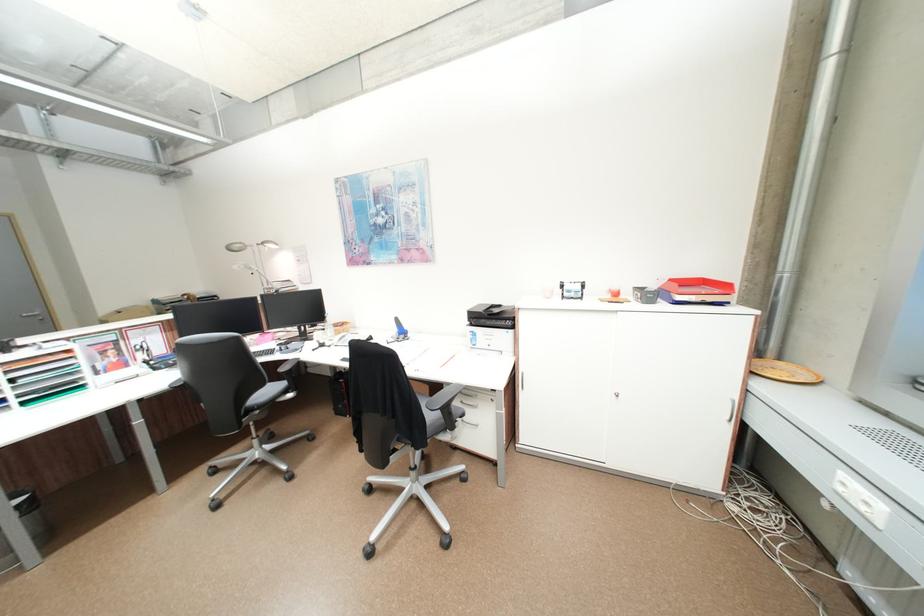
The width and height of the screenshot is (924, 616). Describe the element at coordinates (432, 421) in the screenshot. I see `the black chair sitting surface` at that location.